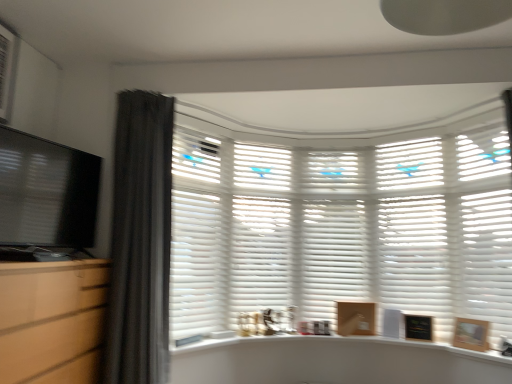
I want to click on space that is in front of wooden picture frame at lower right, which is the 2th picture frame in left-to-right order, so click(x=486, y=353).